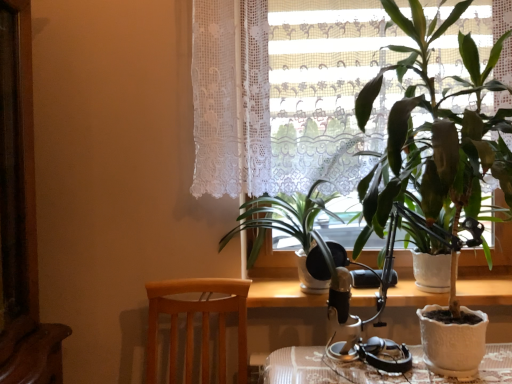
How much space does green glossy plant at center, which is the first houseplant from left to right, occupy horizontally?

green glossy plant at center, which is the first houseplant from left to right, is 24.08 inches wide.

What is the approximate width of green matte houseplant at right, acting as the second houseplant starting from the left?

50.84 centimeters.

At what (x,y) coordinates should I click in order to perform the action: click on green matte houseplant at right, acting as the second houseplant starting from the left. Please return your answer as a coordinate pair (x, y). Looking at the image, I should click on (438, 171).

At what (x,y) coordinates should I click in order to perform the action: click on light brown wood chair at lower left. Please return your answer as a coordinate pair (x, y). Looking at the image, I should click on (192, 323).

From a real-world perspective, who is located lower, wooden table at center or green glossy plant at center, marked as the second houseplant in a right-to-left arrangement?

wooden table at center, from a real-world perspective.

Who is bigger, wooden table at center or green glossy plant at center, which is the first houseplant from left to right?

green glossy plant at center, which is the first houseplant from left to right.

From the image's perspective, is wooden table at center located beneath green glossy plant at center, marked as the second houseplant in a right-to-left arrangement?

Yes, from the image's perspective, wooden table at center is below green glossy plant at center, marked as the second houseplant in a right-to-left arrangement.

Measure the distance from wooden table at center to green glossy plant at center, marked as the second houseplant in a right-to-left arrangement.

wooden table at center and green glossy plant at center, marked as the second houseplant in a right-to-left arrangement, are 11.21 inches apart.

From a real-world perspective, does green glossy plant at center, which is the first houseplant from left to right, sit lower than light brown wood chair at lower left?

No, from a real-world perspective, green glossy plant at center, which is the first houseplant from left to right, is not under light brown wood chair at lower left.

Would you say green glossy plant at center, marked as the second houseplant in a right-to-left arrangement, is to the left or to the right of light brown wood chair at lower left in the picture?

Clearly, green glossy plant at center, marked as the second houseplant in a right-to-left arrangement, is on the right of light brown wood chair at lower left in the image.

Is green glossy plant at center, marked as the second houseplant in a right-to-left arrangement, outside of light brown wood chair at lower left?

Yes, green glossy plant at center, marked as the second houseplant in a right-to-left arrangement, is outside of light brown wood chair at lower left.

Which object is positioned more to the left, green matte houseplant at right, acting as the second houseplant starting from the left, or wooden table at center?

Positioned to the left is wooden table at center.

Considering the points (432, 111) and (471, 300), which point is in front, point (432, 111) or point (471, 300)?

Point (432, 111)

Is green matte houseplant at right, the 1th houseplant positioned from the right, positioned with its back to wooden table at center?

Yes, green matte houseplant at right, the 1th houseplant positioned from the right, is positioned with its back facing wooden table at center.

From a real-world perspective, does white lace curtain at upper center sit lower than light brown wood chair at lower left?

No, from a real-world perspective, white lace curtain at upper center is not beneath light brown wood chair at lower left.

Is point (253, 155) positioned after point (187, 351)?

No, (253, 155) is in front of (187, 351).

Would you say white lace curtain at upper center is inside or outside light brown wood chair at lower left?

white lace curtain at upper center is located beyond the bounds of light brown wood chair at lower left.

Based on the photo, could you tell me if white lace curtain at upper center is turned towards light brown wood chair at lower left?

No, white lace curtain at upper center is not aimed at light brown wood chair at lower left.

Which is closer to the camera, (404, 297) or (478, 166)?

Point (404, 297) is positioned farther from the camera compared to point (478, 166).

Which of these two, wooden table at center or green matte houseplant at right, the 1th houseplant positioned from the right, stands taller?

Standing taller between the two is green matte houseplant at right, the 1th houseplant positioned from the right.

Between wooden table at center and green matte houseplant at right, acting as the second houseplant starting from the left, which one appears on the right side from the viewer's perspective?

green matte houseplant at right, acting as the second houseplant starting from the left, is more to the right.

Does wooden table at center turn towards green matte houseplant at right, the 1th houseplant positioned from the right?

Yes, wooden table at center is facing green matte houseplant at right, the 1th houseplant positioned from the right.

Locate an element on the screen. This screenshot has width=512, height=384. window above the wooden table at center (from the image's perspective) is located at coordinates (231, 96).

How different are the orientations of white lace curtain at upper center and wooden table at center in degrees?

0.811 degrees separate the facing orientations of white lace curtain at upper center and wooden table at center.

Is white lace curtain at upper center in front of wooden table at center?

That is True.

Looking at this image, from the image's perspective, between white lace curtain at upper center and wooden table at center, which one is located above?

white lace curtain at upper center, from the image's perspective.

Which of these two, green glossy plant at center, which is the first houseplant from left to right, or wooden table at center, is wider?

With larger width is green glossy plant at center, which is the first houseplant from left to right.

Is wooden table at center located within green glossy plant at center, which is the first houseplant from left to right?

No.

Is green glossy plant at center, which is the first houseplant from left to right, oriented away from wooden table at center?

green glossy plant at center, which is the first houseplant from left to right, does not have its back to wooden table at center.

What's the angular difference between green glossy plant at center, which is the first houseplant from left to right, and wooden table at center's facing directions?

There is a 0.713-degree angle between the facing directions of green glossy plant at center, which is the first houseplant from left to right, and wooden table at center.

Where is `houseplant on the left of wooden table at center`? houseplant on the left of wooden table at center is located at coordinates tap(285, 227).

Find the location of `houseplant that is the 1st object to the right of the light brown wood chair at lower left, starting at the anchor`. houseplant that is the 1st object to the right of the light brown wood chair at lower left, starting at the anchor is located at coordinates (285, 227).

Which object lies nearer to the anchor point white lace curtain at upper center, wooden table at center or light brown wood chair at lower left?

Among the two, light brown wood chair at lower left is located nearer to white lace curtain at upper center.

Looking at the image, which one is located closer to light brown wood chair at lower left, wooden table at center or green glossy plant at center, marked as the second houseplant in a right-to-left arrangement?

The object closer to light brown wood chair at lower left is green glossy plant at center, marked as the second houseplant in a right-to-left arrangement.

Looking at the image, which one is located further to white lace curtain at upper center, wooden table at center or green glossy plant at center, marked as the second houseplant in a right-to-left arrangement?

wooden table at center is further to white lace curtain at upper center.

From the image, which object appears to be nearer to light brown wood chair at lower left, green glossy plant at center, which is the first houseplant from left to right, or green matte houseplant at right, the 1th houseplant positioned from the right?

The object closer to light brown wood chair at lower left is green glossy plant at center, which is the first houseplant from left to right.

Based on the photo, which object lies nearer to the anchor point light brown wood chair at lower left, green matte houseplant at right, acting as the second houseplant starting from the left, or green glossy plant at center, marked as the second houseplant in a right-to-left arrangement?

green glossy plant at center, marked as the second houseplant in a right-to-left arrangement, is closer to light brown wood chair at lower left.

Considering their positions, is green glossy plant at center, marked as the second houseplant in a right-to-left arrangement, positioned further to green matte houseplant at right, the 1th houseplant positioned from the right, than light brown wood chair at lower left?

light brown wood chair at lower left is positioned further to the anchor green matte houseplant at right, the 1th houseplant positioned from the right.

When comparing their distances from light brown wood chair at lower left, does white lace curtain at upper center or green glossy plant at center, marked as the second houseplant in a right-to-left arrangement, seem further?

white lace curtain at upper center is positioned further to the anchor light brown wood chair at lower left.

From the image, which object appears to be nearer to light brown wood chair at lower left, green matte houseplant at right, the 1th houseplant positioned from the right, or wooden table at center?

wooden table at center is closer to light brown wood chair at lower left.

You are a GUI agent. You are given a task and a screenshot of the screen. Output one action in this format:
    pyautogui.click(x=<x>, y=<y>)
    Task: Click on the table between white lace curtain at upper center and light brown wood chair at lower left in the vertical direction
    This screenshot has width=512, height=384.
    Given the screenshot: What is the action you would take?
    (281, 294)

Where is `houseplant between white lace curtain at upper center and green glossy plant at center, marked as the second houseplant in a right-to-left arrangement, in the vertical direction`? The height and width of the screenshot is (384, 512). houseplant between white lace curtain at upper center and green glossy plant at center, marked as the second houseplant in a right-to-left arrangement, in the vertical direction is located at coordinates (438, 171).

The image size is (512, 384). I want to click on houseplant between green matte houseplant at right, the 1th houseplant positioned from the right, and wooden table at center in the front-back direction, so click(x=285, y=227).

The height and width of the screenshot is (384, 512). Find the location of `houseplant situated between light brown wood chair at lower left and wooden table at center from left to right`. houseplant situated between light brown wood chair at lower left and wooden table at center from left to right is located at coordinates (285, 227).